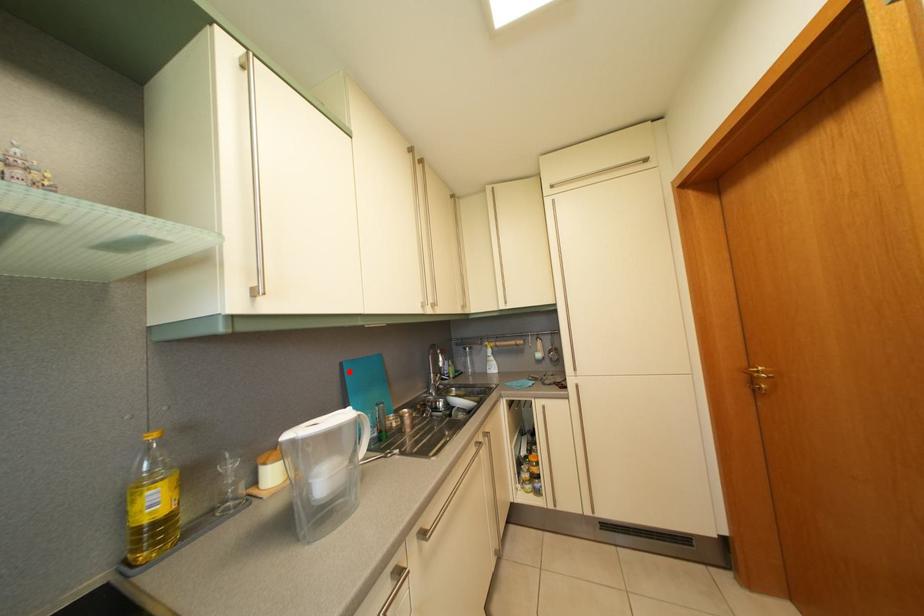
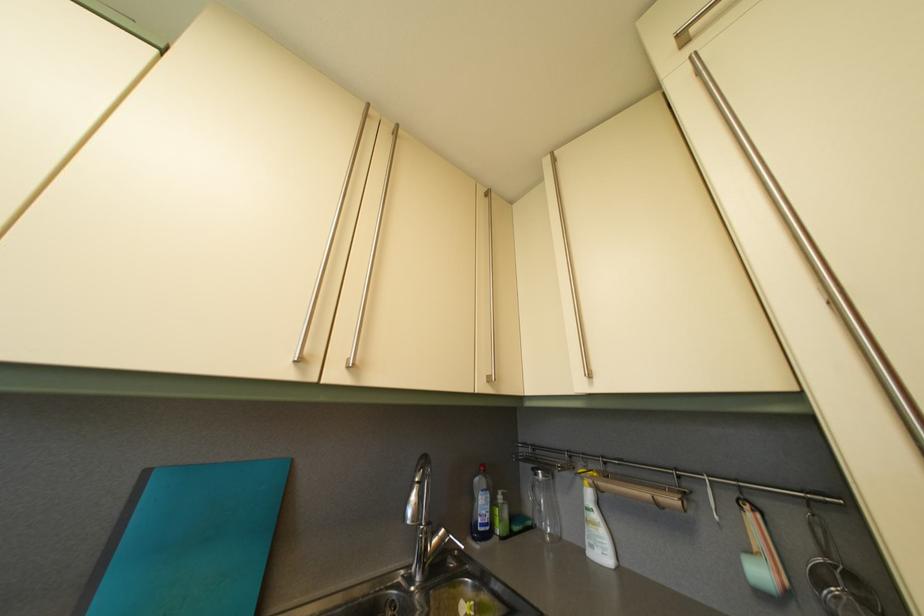
In the second image, find the point that corresponds to the highlighted location in the first image.

(154, 480)